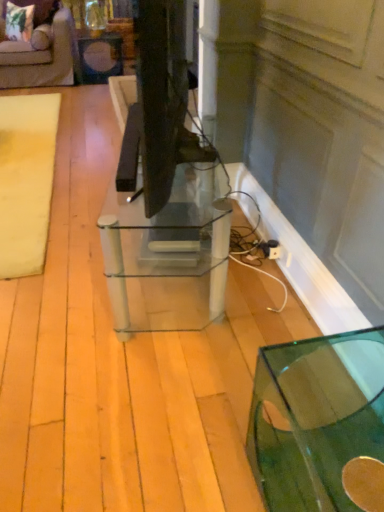
Identify the location of free region on the left part of clear glass table at center, which is counted as the second table, starting from the bottom. The width and height of the screenshot is (384, 512). (52, 248).